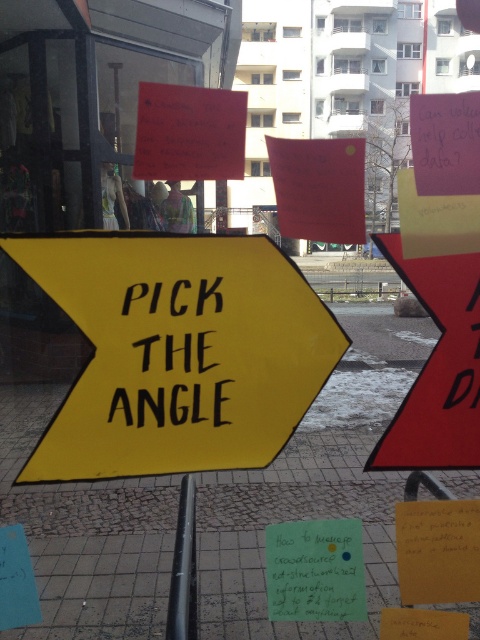
Question: Which of the following is the closest to the observer?

Choices:
 (A) (444, 288)
 (B) (315, 589)

Answer: (A)

Question: Observing the image, what is the correct spatial positioning of red matte arrow at right in reference to black matte pole at center?

Choices:
 (A) left
 (B) right

Answer: (B)

Question: Considering the relative positions of yellow matte arrow at center and green paper sign at center in the image provided, where is yellow matte arrow at center located with respect to green paper sign at center?

Choices:
 (A) below
 (B) above

Answer: (B)

Question: Is black matte text at center to the right of black matte pole at center from the viewer's perspective?

Choices:
 (A) no
 (B) yes

Answer: (B)

Question: Which point is farther from the camera taking this photo?

Choices:
 (A) (128, 406)
 (B) (451, 356)

Answer: (B)

Question: Among these points, which one is nearest to the camera?

Choices:
 (A) (180, 531)
 (B) (337, 538)

Answer: (B)